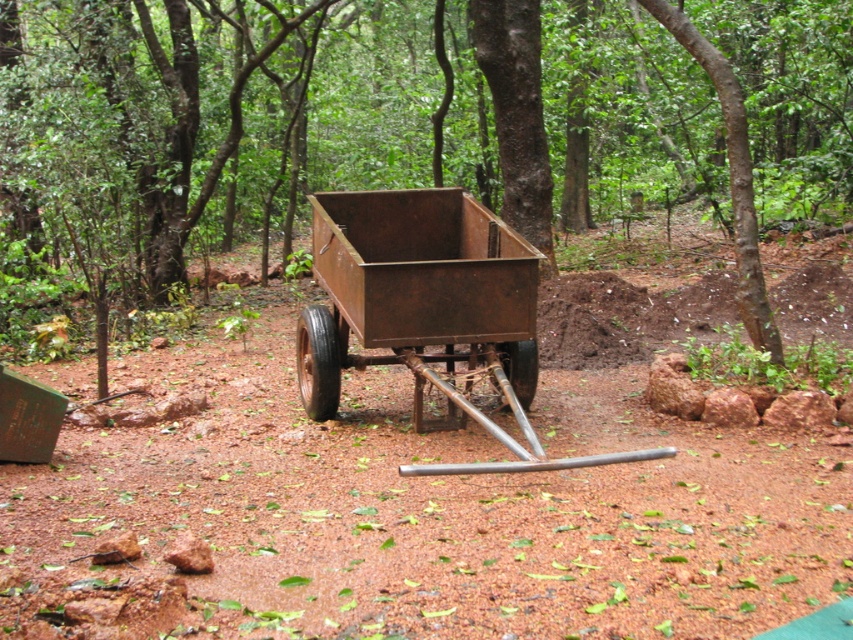
Between rusty metal cart at center and rusty metal wagon at center, which one is positioned higher?

Positioned higher is rusty metal cart at center.

Does rusty metal cart at center lie behind rusty metal wagon at center?

Yes, it is behind rusty metal wagon at center.

Who is more forward, (587, 179) or (468, 410)?

Positioned in front is point (468, 410).

At what (x,y) coordinates should I click in order to perform the action: click on rusty metal cart at center. Please return your answer as a coordinate pair (x, y). The height and width of the screenshot is (640, 853). Looking at the image, I should click on (331, 120).